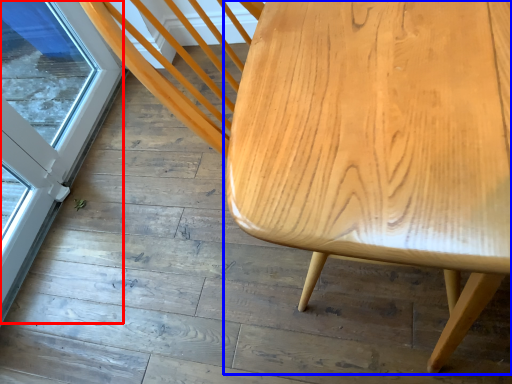
Question: Which of the following is the closest to the observer, screen door (highlighted by a red box) or table (highlighted by a blue box)?

Choices:
 (A) screen door
 (B) table

Answer: (B)